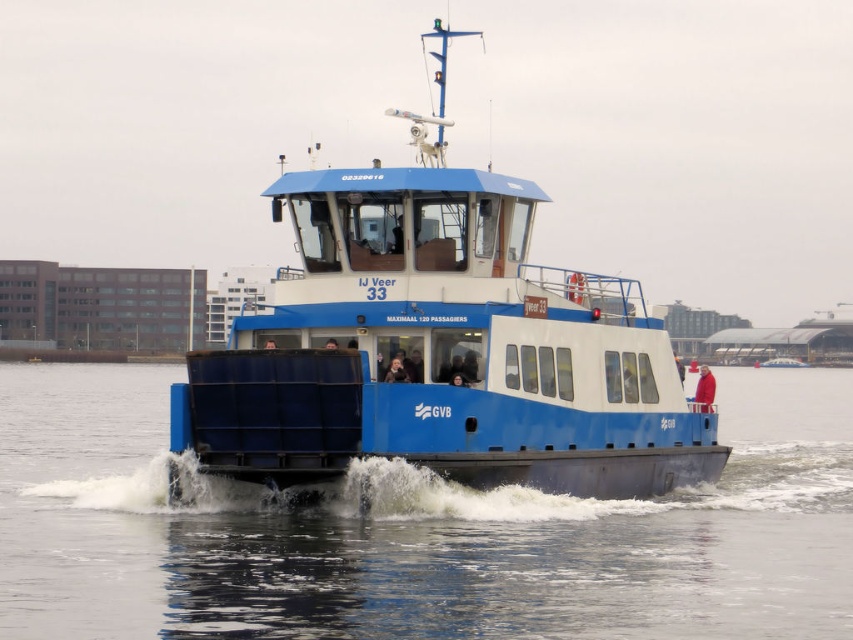
Question: Can you confirm if blue metallic water at center is wider than red woolen sweater at center?

Choices:
 (A) yes
 (B) no

Answer: (A)

Question: Among these points, which one is farthest from the camera?

Choices:
 (A) (622, 611)
 (B) (711, 380)
 (C) (242, 396)

Answer: (B)

Question: Based on their relative distances, which object is farther from the blue matte ferry at center?

Choices:
 (A) blue metallic water at center
 (B) red woolen sweater at center

Answer: (B)

Question: Which object is farther from the camera taking this photo?

Choices:
 (A) blue metallic water at center
 (B) red woolen sweater at center
 (C) blue matte ferry at center

Answer: (B)

Question: Is blue metallic water at center to the left of blue matte ferry at center from the viewer's perspective?

Choices:
 (A) yes
 (B) no

Answer: (A)

Question: Does blue metallic water at center come behind blue matte ferry at center?

Choices:
 (A) yes
 (B) no

Answer: (B)